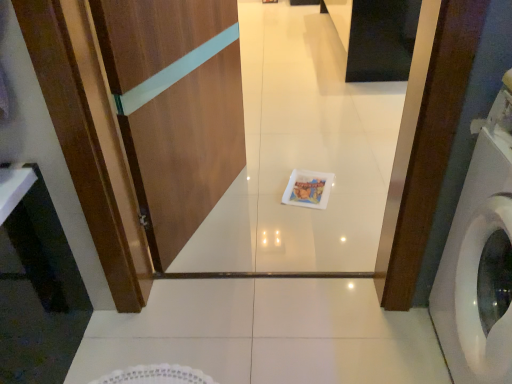
Question: Is black glossy cabinet at upper center not within white plastic washing machine at right?

Choices:
 (A) yes
 (B) no

Answer: (A)

Question: Is black glossy cabinet at upper center turned away from white plastic washing machine at right?

Choices:
 (A) yes
 (B) no

Answer: (B)

Question: From a real-world perspective, is black glossy cabinet at upper center under white plastic washing machine at right?

Choices:
 (A) no
 (B) yes

Answer: (B)

Question: Is black glossy cabinet at upper center to the right of white plastic washing machine at right from the viewer's perspective?

Choices:
 (A) no
 (B) yes

Answer: (B)

Question: Is black glossy cabinet at upper center beside white plastic washing machine at right?

Choices:
 (A) yes
 (B) no

Answer: (B)

Question: Is white plastic washing machine at right a part of black glossy cabinet at upper center?

Choices:
 (A) no
 (B) yes

Answer: (A)

Question: Is wooden screen door at center aimed at black glossy cabinet at upper center?

Choices:
 (A) no
 (B) yes

Answer: (A)

Question: From the image's perspective, is wooden screen door at center under black glossy cabinet at upper center?

Choices:
 (A) no
 (B) yes

Answer: (B)

Question: Is the depth of wooden screen door at center greater than that of black glossy cabinet at upper center?

Choices:
 (A) no
 (B) yes

Answer: (A)

Question: From the image's perspective, is wooden screen door at center on top of black glossy cabinet at upper center?

Choices:
 (A) no
 (B) yes

Answer: (A)

Question: Can you confirm if wooden screen door at center is wider than black glossy cabinet at upper center?

Choices:
 (A) no
 (B) yes

Answer: (A)

Question: From a real-world perspective, is wooden screen door at center physically below black glossy cabinet at upper center?

Choices:
 (A) no
 (B) yes

Answer: (A)

Question: Is white plastic washing machine at right at the left side of black glossy cabinet at upper center?

Choices:
 (A) yes
 (B) no

Answer: (A)